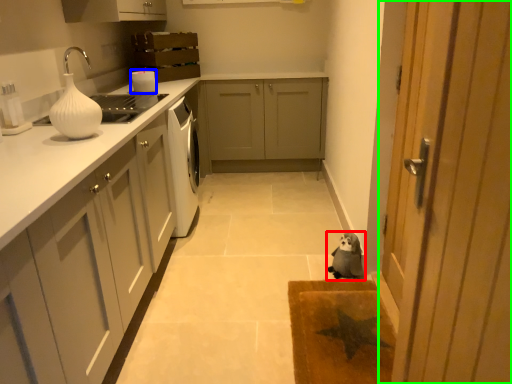
Question: Which object is positioned closest to dog (highlighted by a red box)? Select from appliance (highlighted by a blue box) and door (highlighted by a green box).

Choices:
 (A) appliance
 (B) door

Answer: (B)